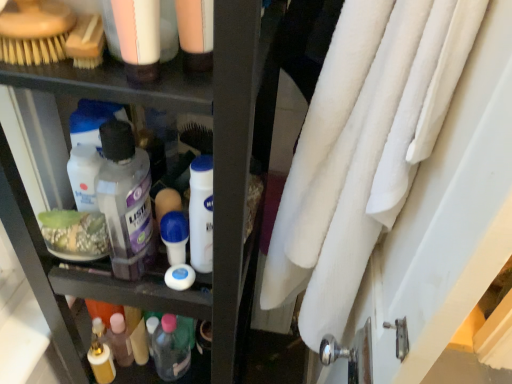
Question: Is matte plastic lotion at upper left, positioned as the 4th toiletry in bottom-to-top order, not near white matte lotion at center, the 2th toiletry from the front?

Choices:
 (A) no
 (B) yes

Answer: (A)

Question: From a real-world perspective, is matte plastic lotion at upper left, the fourth toiletry positioned from the back, positioned under white matte lotion at center, which ranks as the 2th toiletry in top-to-bottom order, based on gravity?

Choices:
 (A) no
 (B) yes

Answer: (A)

Question: Considering the relative positions of matte plastic lotion at upper left, the fourth toiletry positioned from the back, and white matte lotion at center, which ranks as the 2th toiletry in top-to-bottom order, in the image provided, is matte plastic lotion at upper left, the fourth toiletry positioned from the back, to the right of white matte lotion at center, which ranks as the 2th toiletry in top-to-bottom order, from the viewer's perspective?

Choices:
 (A) yes
 (B) no

Answer: (B)

Question: Are matte plastic lotion at upper left, positioned as the 4th toiletry in bottom-to-top order, and white matte lotion at center, placed as the third toiletry when sorted from bottom to top, beside each other?

Choices:
 (A) yes
 (B) no

Answer: (B)

Question: From the image's perspective, is matte plastic lotion at upper left, the fourth toiletry positioned from the back, located above white matte lotion at center, placed as the third toiletry when sorted from bottom to top?

Choices:
 (A) yes
 (B) no

Answer: (A)

Question: Does matte plastic lotion at upper left, the fourth toiletry positioned from the back, have a lesser height compared to white matte lotion at center, the 2th toiletry from the front?

Choices:
 (A) yes
 (B) no

Answer: (A)

Question: Considering the relative positions of white fluffy towel at right and transparent plastic mouthwash at center in the image provided, is white fluffy towel at right to the right of transparent plastic mouthwash at center from the viewer's perspective?

Choices:
 (A) no
 (B) yes

Answer: (B)

Question: Is white fluffy towel at right thinner than transparent plastic mouthwash at center?

Choices:
 (A) yes
 (B) no

Answer: (A)

Question: Does white fluffy towel at right lie in front of transparent plastic mouthwash at center?

Choices:
 (A) no
 (B) yes

Answer: (B)

Question: Are white fluffy towel at right and transparent plastic mouthwash at center far apart?

Choices:
 (A) no
 (B) yes

Answer: (A)

Question: Could transparent plastic mouthwash at center be considered to be inside white fluffy towel at right?

Choices:
 (A) no
 (B) yes

Answer: (A)

Question: From a real-world perspective, is white fluffy towel at right physically below transparent plastic mouthwash at center?

Choices:
 (A) no
 (B) yes

Answer: (B)

Question: Is matte black shelf at center positioned with its back to translucent plastic bottle at lower center, which is counted as the 1th toiletry, starting from the back?

Choices:
 (A) no
 (B) yes

Answer: (B)